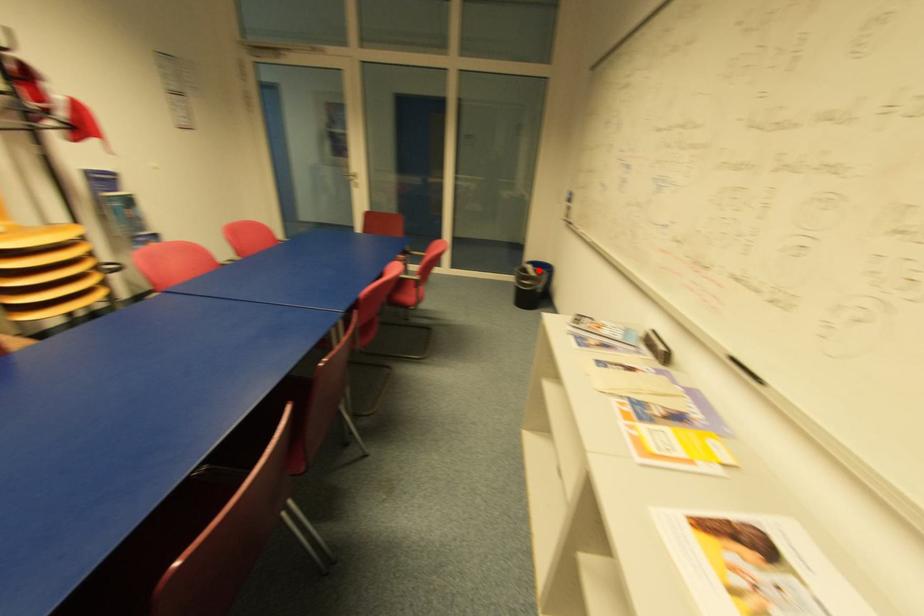
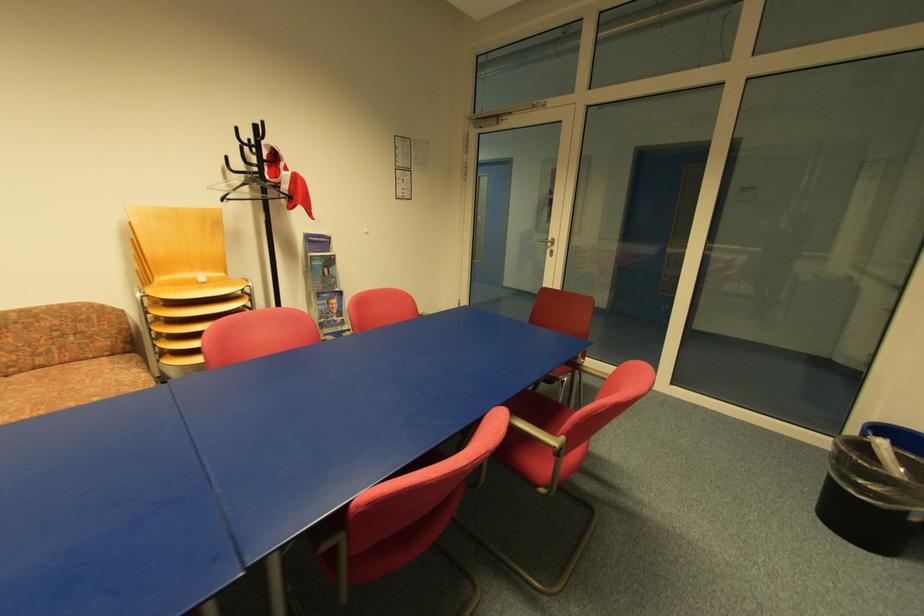
Where in the second image is the point corresponding to the highlighted location from the first image?

(906, 459)